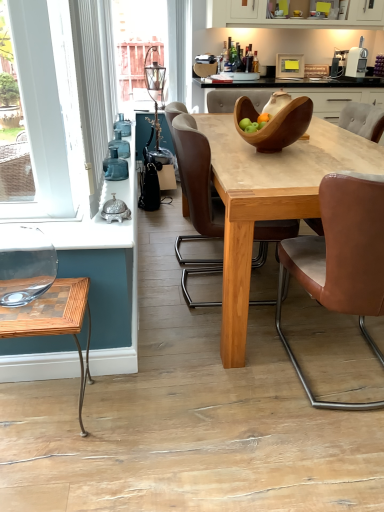
I want to click on vacant region in front of wooden checkered coffee table at lower left, so click(x=54, y=474).